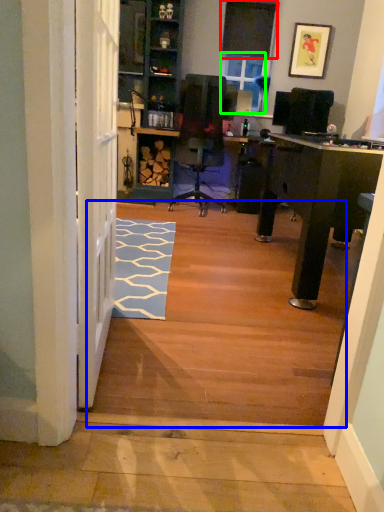
Question: Which object is positioned farthest from window screen (highlighted by a red box)? Select from stairwell (highlighted by a blue box) and window screen (highlighted by a green box).

Choices:
 (A) stairwell
 (B) window screen

Answer: (A)